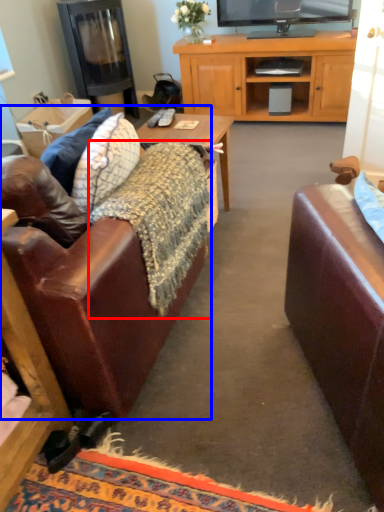
Question: Among these objects, which one is nearest to the camera, blanket (highlighted by a red box) or studio couch (highlighted by a blue box)?

Choices:
 (A) blanket
 (B) studio couch

Answer: (B)